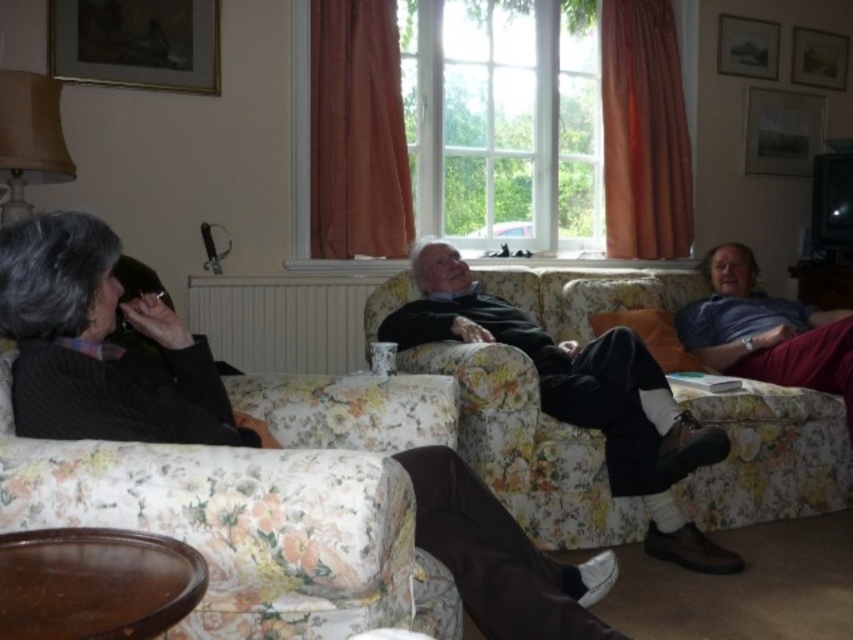
You are an interior designer planning to place a new decorative item in the living room. The item must be placed exactly where the black sweater at center is currently located. What are the coordinates of the spot where you should place the new item?

The coordinates for placing the new item should be at point (100,346), as that is where the black sweater at center is located.

You are a tailor measuring sweaters for a client. You see the black sweater at center and the dark green sweater at center. Which sweater is shorter in height?

The black sweater at center is not as tall as the dark green sweater at center, so the black sweater at center is shorter in height.